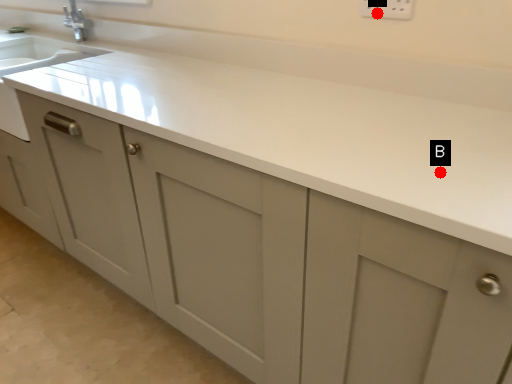
Question: Two points are circled on the image, labeled by A and B beside each circle. Which point is farther to the camera?

Choices:
 (A) A is further
 (B) B is further

Answer: (A)